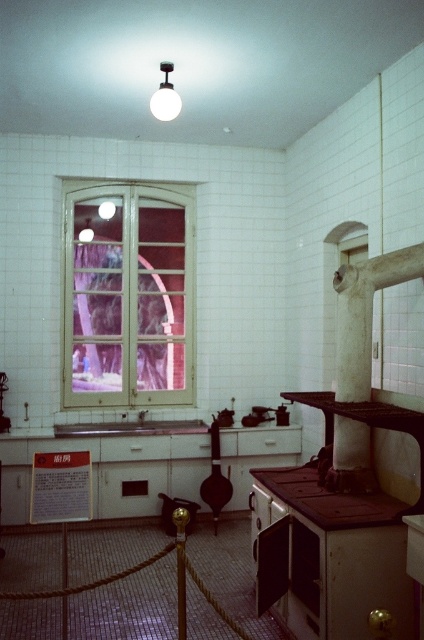
Does white wooden window at center appear on the right side of brown matte stove at lower right?

Incorrect, white wooden window at center is not on the right side of brown matte stove at lower right.

Which is below, white wooden window at center or brown matte stove at lower right?

brown matte stove at lower right is lower down.

Is point (166, 292) in front of point (287, 500)?

That is False.

Find the location of a particular element. The height and width of the screenshot is (640, 424). white wooden window at center is located at coordinates (128, 296).

Is the position of white wooden window at center more distant than that of white glossy sink at center?

Yes, it is behind white glossy sink at center.

Measure the distance between white wooden window at center and white glossy sink at center.

white wooden window at center is 35.68 inches from white glossy sink at center.

Does point (64, 260) lie in front of point (80, 436)?

No, (64, 260) is further to viewer.

Locate an element on the screen. This screenshot has height=640, width=424. white wooden window at center is located at coordinates (128, 296).

Between point (261, 481) and point (114, 426), which one is positioned behind?

The point (114, 426) is behind.

Is point (342, 525) more distant than point (125, 429)?

No, it is not.

Where is `brown matte stove at lower right`? This screenshot has width=424, height=640. brown matte stove at lower right is located at coordinates (329, 499).